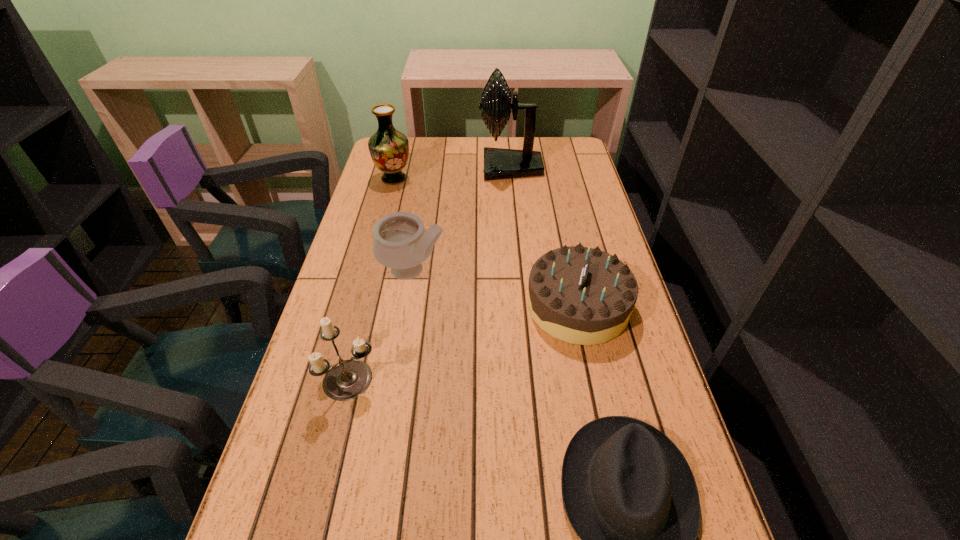
Identify which object is the third nearest to the fifth shortest object. Please provide its 2D coordinates. Your answer should be formatted as a tuple, i.e. [(x, y)], where the tuple contains the x and y coordinates of a point satisfying the conditions above.

[(580, 295)]